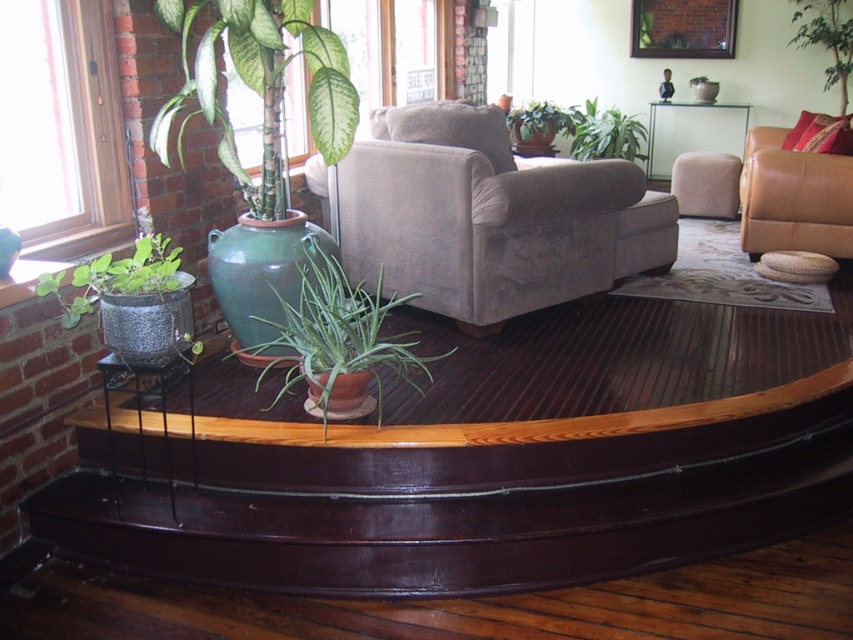
Can you confirm if green glossy vase at upper left is positioned above green textured pot at lower left?

Correct, green glossy vase at upper left is located above green textured pot at lower left.

Who is positioned more to the right, green glossy vase at upper left or green textured pot at lower left?

From the viewer's perspective, green glossy vase at upper left appears more on the right side.

Which is behind, point (178, 22) or point (161, 273)?

The point (178, 22) is more distant.

Where is `green glossy vase at upper left`? green glossy vase at upper left is located at coordinates (259, 86).

Can you confirm if velvet beige armchair at center is positioned below green textured pot at lower left?

Actually, velvet beige armchair at center is above green textured pot at lower left.

Who is more forward, (663, 259) or (148, 298)?

Point (148, 298)

Identify the location of velvet beige armchair at center. The image size is (853, 640). (486, 216).

Is point (595, 253) farther from camera compared to point (846, 92)?

No, it is not.

Who is positioned more to the right, velvet beige armchair at center or green glossy plant at upper right?

green glossy plant at upper right

Does point (521, 285) come behind point (817, 38)?

No.

Find the location of a particular element. velvet beige armchair at center is located at coordinates (486, 216).